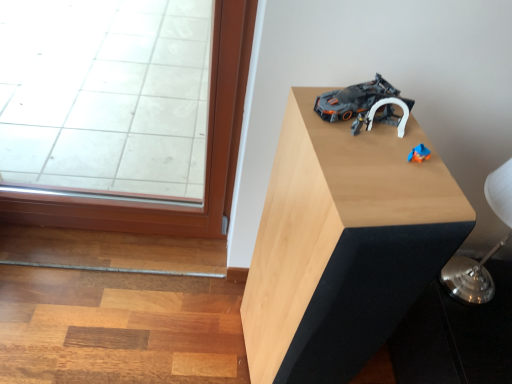
Question: From a real-world perspective, is light wood table at upper right positioned under dark gray plastic toy car at upper right based on gravity?

Choices:
 (A) no
 (B) yes

Answer: (B)

Question: From a real-world perspective, does light wood table at upper right stand above dark gray plastic toy car at upper right?

Choices:
 (A) yes
 (B) no

Answer: (B)

Question: Is the depth of light wood table at upper right greater than that of dark gray plastic toy car at upper right?

Choices:
 (A) yes
 (B) no

Answer: (B)

Question: From the image's perspective, is light wood table at upper right below dark gray plastic toy car at upper right?

Choices:
 (A) yes
 (B) no

Answer: (A)

Question: Is light wood table at upper right facing towards dark gray plastic toy car at upper right?

Choices:
 (A) yes
 (B) no

Answer: (B)

Question: Can you confirm if light wood table at upper right is shorter than dark gray plastic toy car at upper right?

Choices:
 (A) yes
 (B) no

Answer: (B)

Question: From the image's perspective, is light wood table at upper right on top of silver metallic table lamp at upper right?

Choices:
 (A) yes
 (B) no

Answer: (B)

Question: Is light wood table at upper right turned away from silver metallic table lamp at upper right?

Choices:
 (A) no
 (B) yes

Answer: (A)

Question: Is light wood table at upper right wider than silver metallic table lamp at upper right?

Choices:
 (A) yes
 (B) no

Answer: (A)

Question: Is light wood table at upper right next to silver metallic table lamp at upper right and touching it?

Choices:
 (A) no
 (B) yes

Answer: (A)

Question: Can you confirm if light wood table at upper right is positioned to the right of silver metallic table lamp at upper right?

Choices:
 (A) no
 (B) yes

Answer: (A)

Question: From a real-world perspective, is light wood table at upper right located higher than silver metallic table lamp at upper right?

Choices:
 (A) no
 (B) yes

Answer: (A)

Question: Can you confirm if dark gray plastic toy car at upper right is shorter than light wood table at upper right?

Choices:
 (A) no
 (B) yes

Answer: (B)